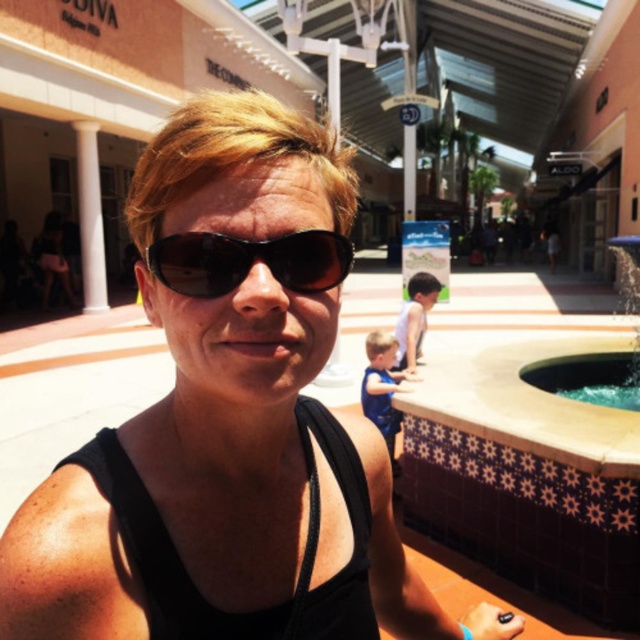
Can you confirm if sunglasses at center is wider than white marble pillar at left?

Incorrect, sunglasses at center's width does not surpass white marble pillar at left's.

Does sunglasses at center appear on the right side of white marble pillar at left?

Indeed, sunglasses at center is positioned on the right side of white marble pillar at left.

Who is more distant from viewer, (198,236) or (90,145)?

The point (90,145) is behind.

Locate an element on the screen. The height and width of the screenshot is (640, 640). sunglasses at center is located at coordinates (248, 260).

Does black fabric vest at center have a greater width compared to sunglasses at center?

Yes, black fabric vest at center is wider than sunglasses at center.

Does black fabric vest at center have a larger size compared to sunglasses at center?

Yes.

Locate an element on the screen. black fabric vest at center is located at coordinates (301, 561).

Where is `black fabric vest at center`? black fabric vest at center is located at coordinates point(301,561).

Is black fabric vest at center to the right of clear glass pool at lower right from the viewer's perspective?

In fact, black fabric vest at center is to the left of clear glass pool at lower right.

Between point (358, 499) and point (614, 381), which one is positioned behind?

Positioned behind is point (614, 381).

This screenshot has height=640, width=640. Identify the location of black fabric vest at center. (301, 561).